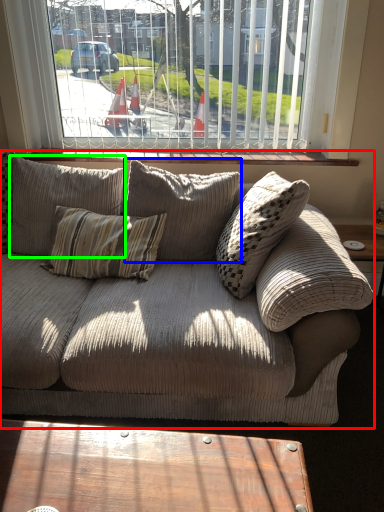
Question: Estimate the real-world distances between objects in this image. Which object is farther from studio couch (highlighted by a red box), pillow (highlighted by a blue box) or pillow (highlighted by a green box)?

Choices:
 (A) pillow
 (B) pillow

Answer: (B)